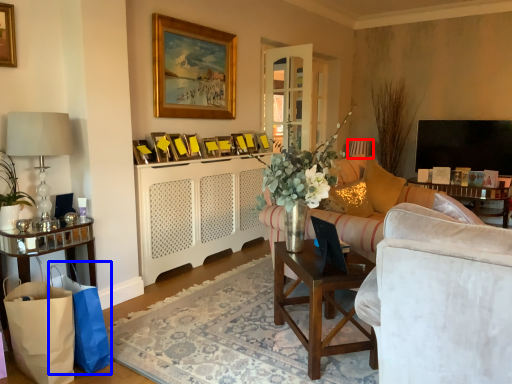
Question: Which of the following is the closest to the observer, lamp (highlighted by a red box) or shopping bag (highlighted by a blue box)?

Choices:
 (A) lamp
 (B) shopping bag

Answer: (B)